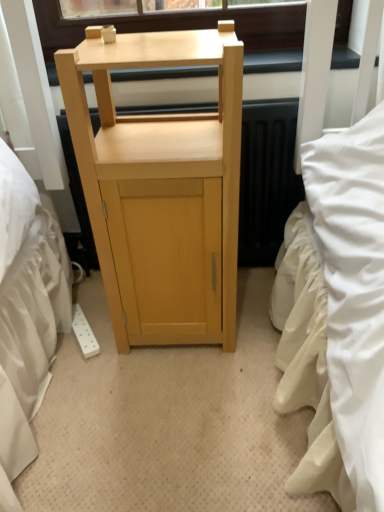
The height and width of the screenshot is (512, 384). In order to click on vacant space in front of light wood cabinet at center in this screenshot , I will do `click(178, 409)`.